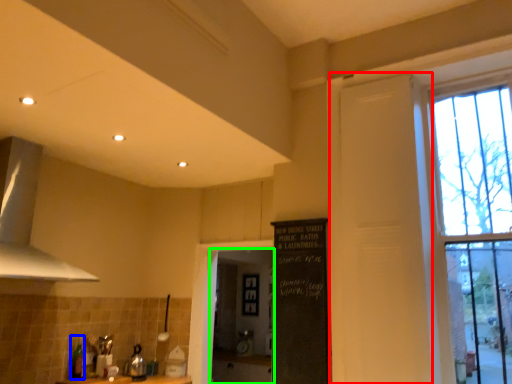
Question: Which object is positioned farthest from screen door (highlighted by a red box)? Select from bottle (highlighted by a blue box) and screen door (highlighted by a green box).

Choices:
 (A) bottle
 (B) screen door

Answer: (B)